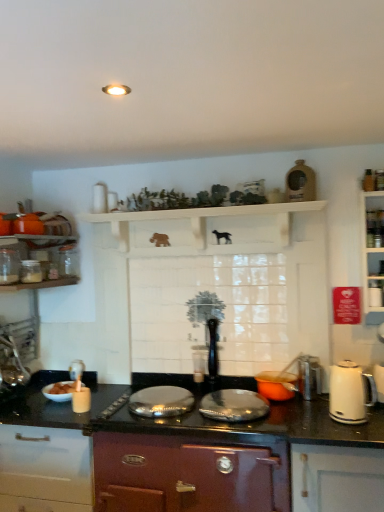
Question: Is white glossy bowl at lower left thinner than orange matte pot at center, marked as the third kitchen appliance in a left-to-right arrangement?

Choices:
 (A) yes
 (B) no

Answer: (A)

Question: From the image's perspective, is white glossy bowl at lower left below orange matte pot at center, positioned as the fourth kitchen appliance in top-to-bottom order?

Choices:
 (A) yes
 (B) no

Answer: (A)

Question: Is white glossy bowl at lower left at the left side of orange matte pot at center, positioned as the fourth kitchen appliance in top-to-bottom order?

Choices:
 (A) yes
 (B) no

Answer: (A)

Question: Is white glossy bowl at lower left not close to orange matte pot at center, marked as the third kitchen appliance in a left-to-right arrangement?

Choices:
 (A) no
 (B) yes

Answer: (A)

Question: Would you say white glossy bowl at lower left contains orange matte pot at center, marked as the third kitchen appliance in a left-to-right arrangement?

Choices:
 (A) no
 (B) yes

Answer: (A)

Question: From a real-world perspective, relative to clear glass jar at left, which is the second kitchen appliance in top-to-bottom order, is white glossy bowl at lower left vertically above or below?

Choices:
 (A) above
 (B) below

Answer: (B)

Question: Based on their positions, is white glossy bowl at lower left located to the left or right of clear glass jar at left, the third kitchen appliance when ordered from bottom to top?

Choices:
 (A) right
 (B) left

Answer: (A)

Question: Considering the positions of white glossy bowl at lower left and clear glass jar at left, the 2th kitchen appliance positioned from the left, in the image, is white glossy bowl at lower left wider or thinner than clear glass jar at left, the 2th kitchen appliance positioned from the left,?

Choices:
 (A) wide
 (B) thin

Answer: (A)

Question: Is white glossy bowl at lower left in front of or behind clear glass jar at left, the 2th kitchen appliance positioned from the left, in the image?

Choices:
 (A) behind
 (B) front

Answer: (A)

Question: Looking at the image, does white glossy kettle at right, which ranks as the third kitchen appliance in top-to-bottom order, seem bigger or smaller compared to white glossy bowl at lower left?

Choices:
 (A) small
 (B) big

Answer: (B)

Question: Considering the positions of white glossy kettle at right, which ranks as the third kitchen appliance in top-to-bottom order, and white glossy bowl at lower left in the image, is white glossy kettle at right, which ranks as the third kitchen appliance in top-to-bottom order, taller or shorter than white glossy bowl at lower left?

Choices:
 (A) tall
 (B) short

Answer: (A)

Question: Does point click(x=347, y=418) appear closer or farther from the camera than point click(x=69, y=382)?

Choices:
 (A) farther
 (B) closer

Answer: (B)

Question: Is white glossy kettle at right, which is the fourth kitchen appliance from left to right, situated inside white glossy bowl at lower left or outside?

Choices:
 (A) outside
 (B) inside

Answer: (A)

Question: From a real-world perspective, is white wooden shelf at upper center positioned above or below clear glass jar at left, the third kitchen appliance when ordered from bottom to top?

Choices:
 (A) below
 (B) above

Answer: (B)

Question: Is white wooden shelf at upper center wider or thinner than clear glass jar at left, the 2th kitchen appliance positioned from the left?

Choices:
 (A) thin
 (B) wide

Answer: (B)